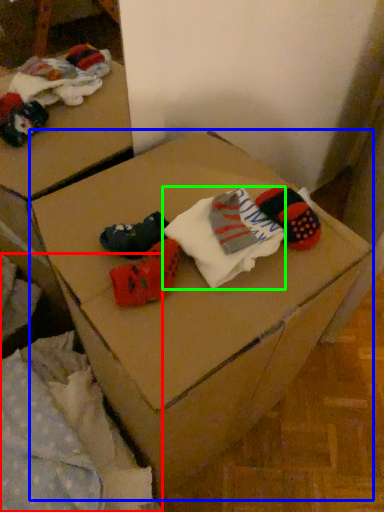
Question: Based on their relative distances, which object is nearer to bedding (highlighted by a red box)? Choose from furniture (highlighted by a blue box) and sock (highlighted by a green box).

Choices:
 (A) furniture
 (B) sock

Answer: (A)